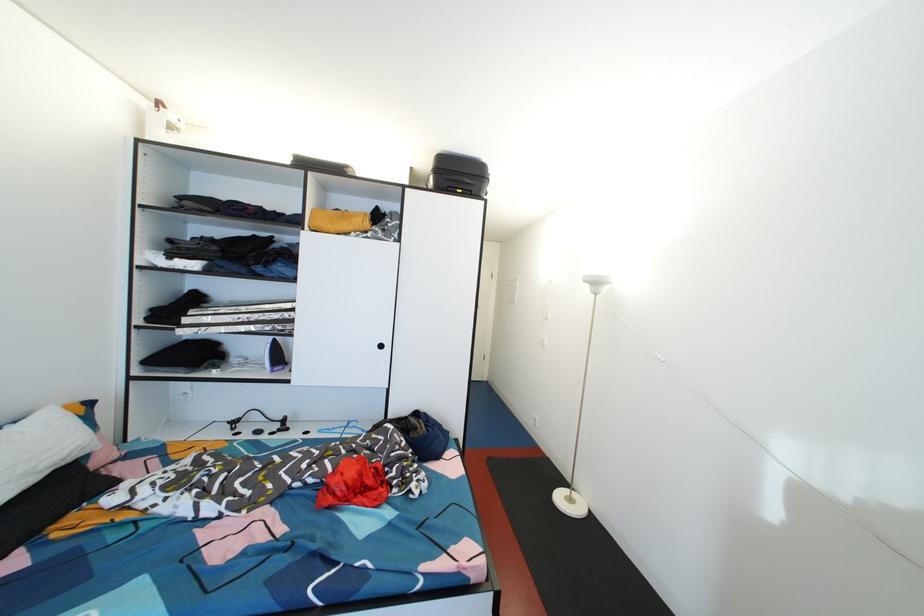
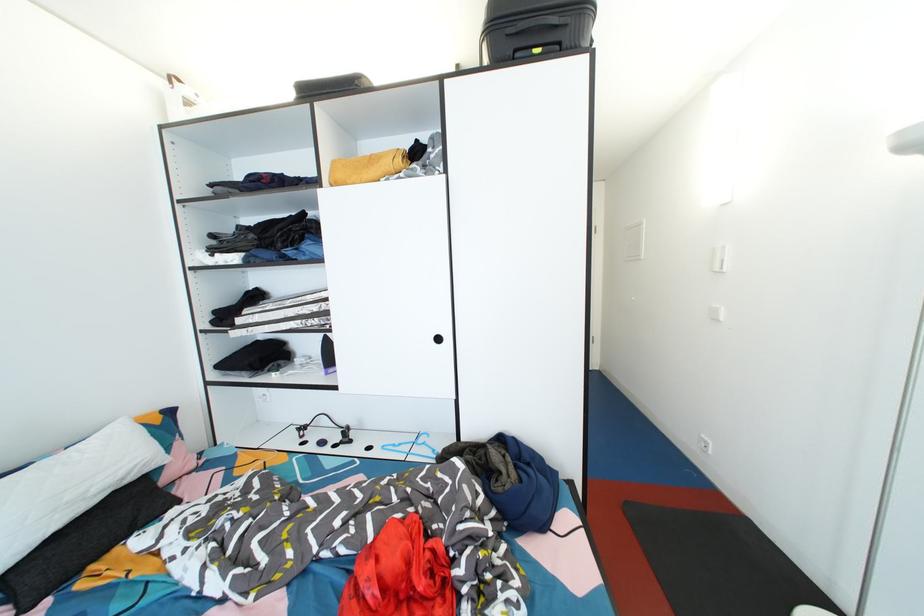
The point at (438, 182) is marked in the first image. Where is the corresponding point in the second image?

(492, 51)